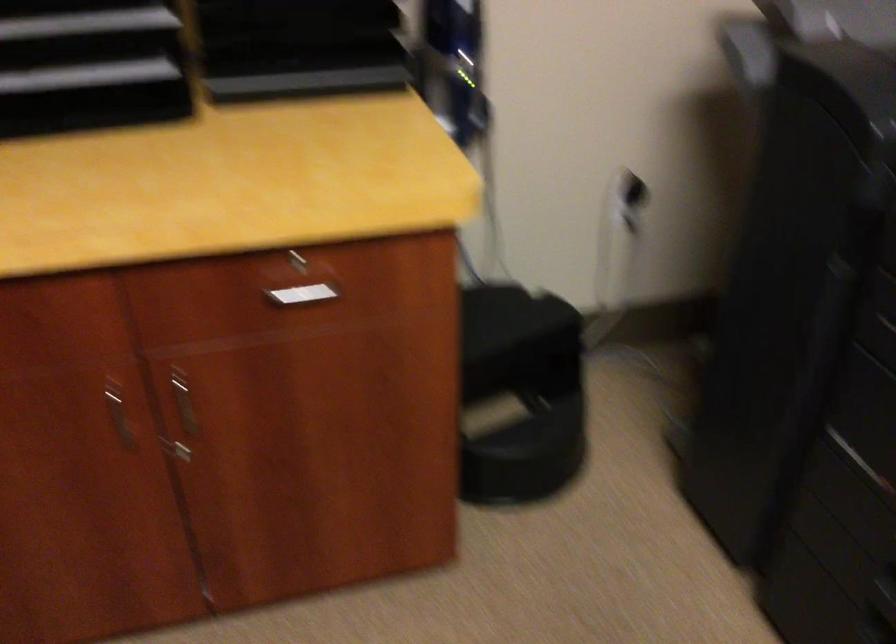
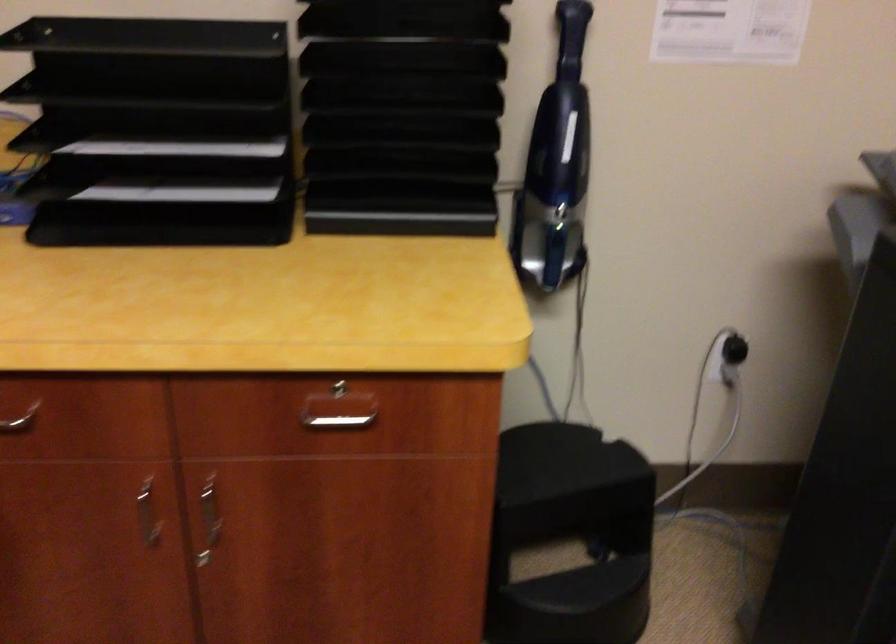
The point at (179,412) is marked in the first image. Where is the corresponding point in the second image?

(209, 520)